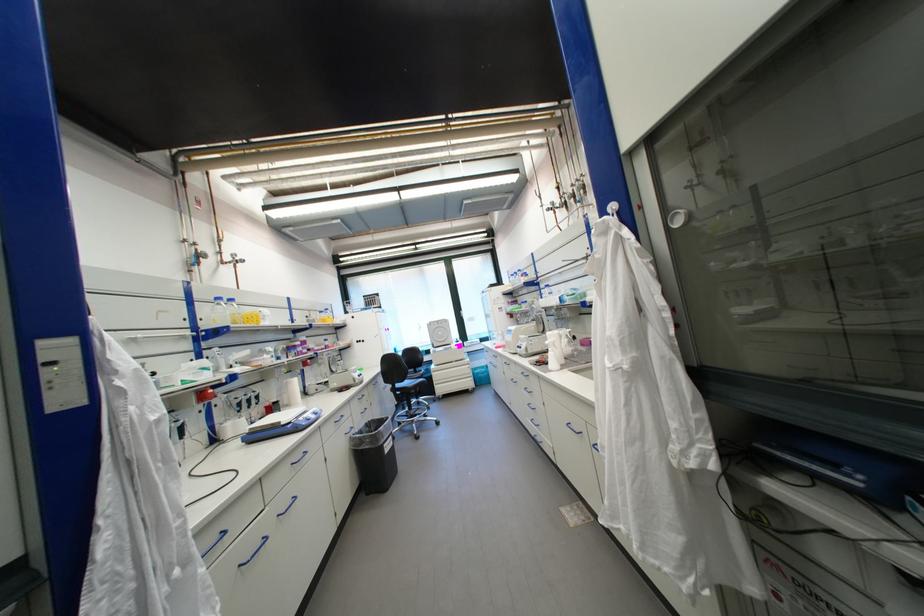
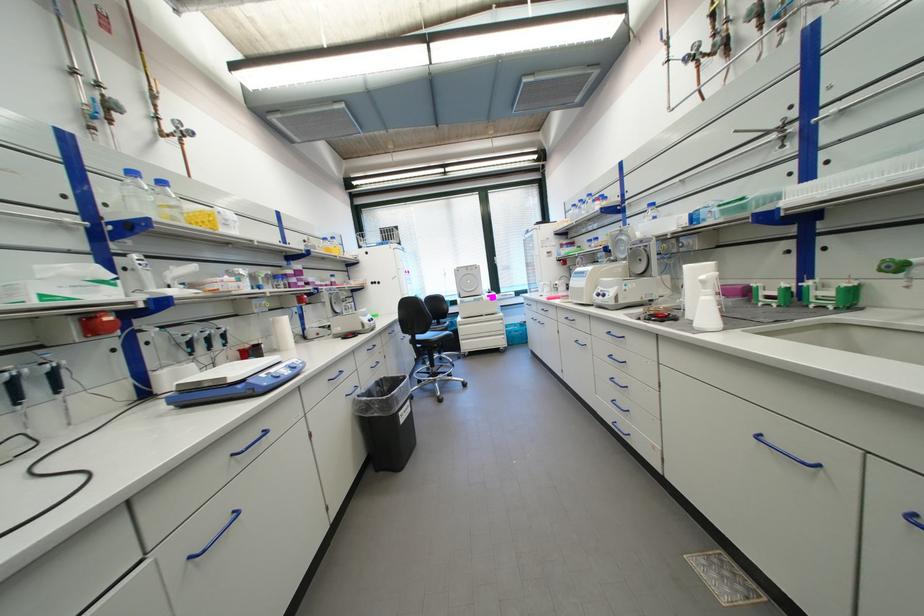
The point at (226,300) is marked in the first image. Where is the corresponding point in the second image?

(140, 174)